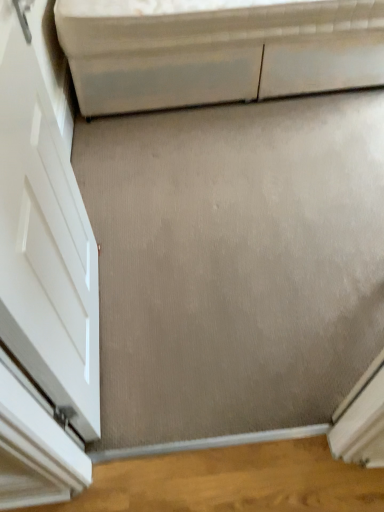
Locate an element on the screen. free space to the back side of white glossy door at left is located at coordinates (143, 237).